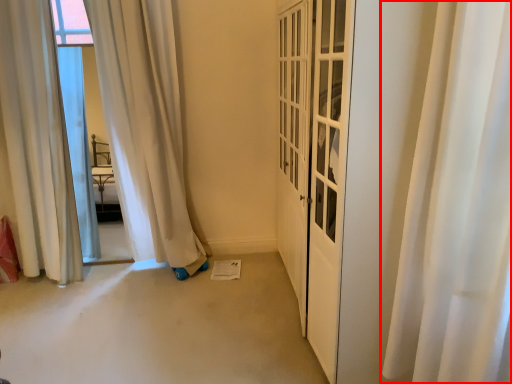
Question: Where is curtain (annotated by the red box) located in relation to curtain in the image?

Choices:
 (A) left
 (B) right

Answer: (B)